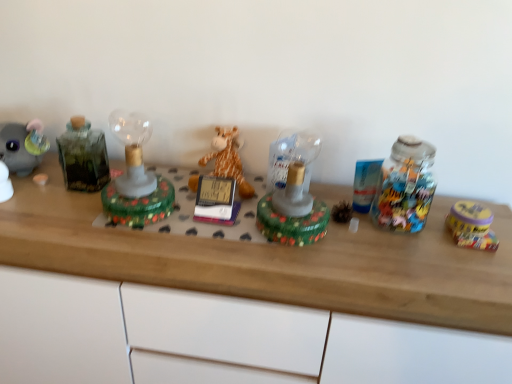
Locate an element on the screen. blank space to the left of green glass lamp at center, the 1th toy in the left-to-right sequence is located at coordinates (58, 216).